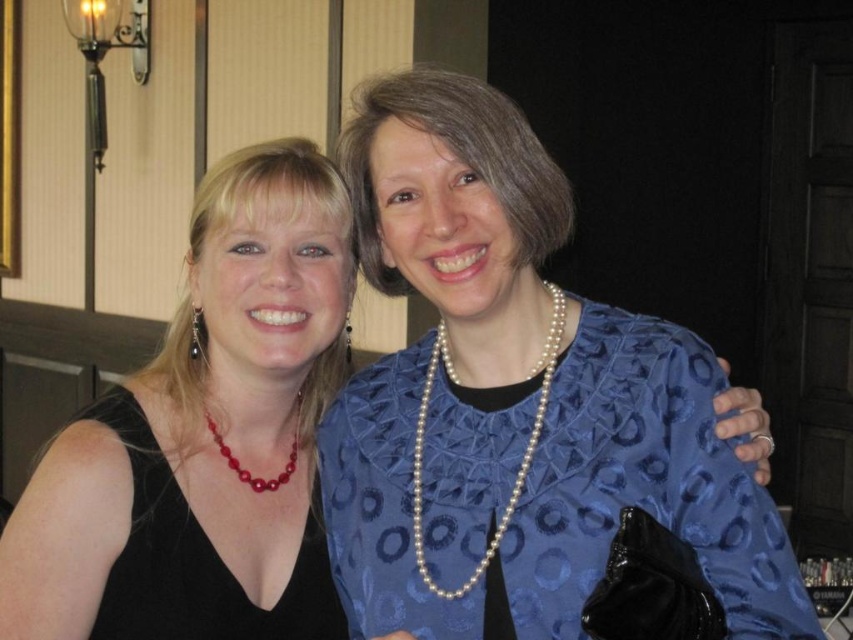
Question: Which object is positioned farthest from the red pearl necklace at center?

Choices:
 (A) black silk dress at center
 (B) matte black dress at left
 (C) pearl necklace at center

Answer: (C)

Question: Which object appears closest to the camera in this image?

Choices:
 (A) pearl necklace at center
 (B) blue satin dress at center

Answer: (B)

Question: Is the position of black silk dress at center less distant than that of black satin dress at left?

Choices:
 (A) no
 (B) yes

Answer: (B)

Question: Which point is closer to the camera?

Choices:
 (A) (235, 348)
 (B) (311, 161)
 (C) (131, 451)
 (D) (393, 561)

Answer: (D)

Question: Is blue satin dress at center bigger than red pearl necklace at center?

Choices:
 (A) yes
 (B) no

Answer: (A)

Question: Can you confirm if black silk dress at center is thinner than red pearl necklace at center?

Choices:
 (A) yes
 (B) no

Answer: (B)